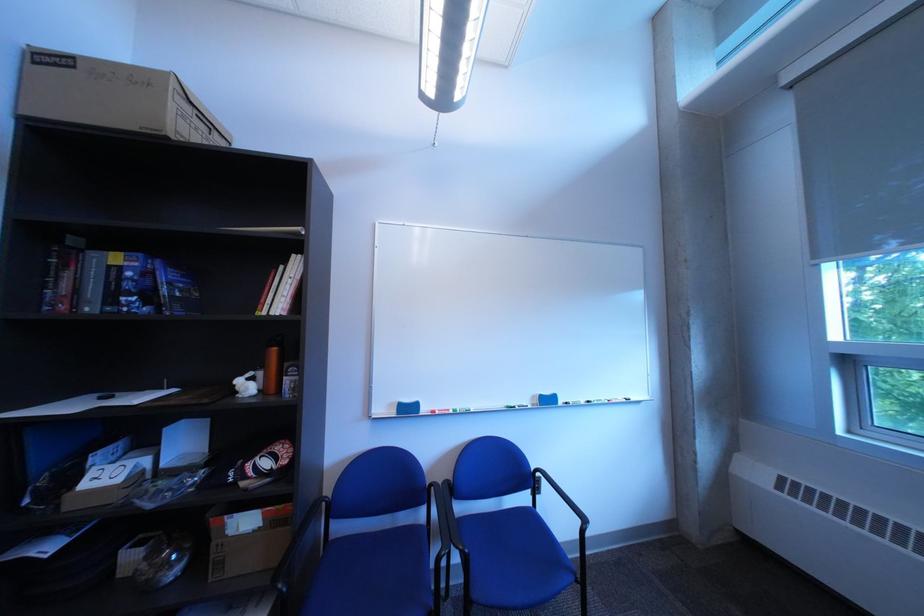
What do you see at coordinates (273, 365) in the screenshot? Image resolution: width=924 pixels, height=616 pixels. I see `the orange water bottle` at bounding box center [273, 365].